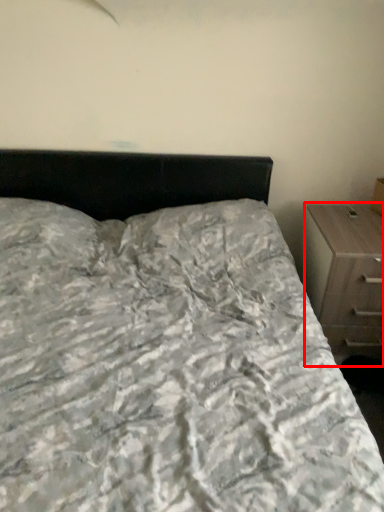
Question: Observing the image, what is the correct spatial positioning of chest of drawers (annotated by the red box) in reference to bed?

Choices:
 (A) left
 (B) right

Answer: (B)